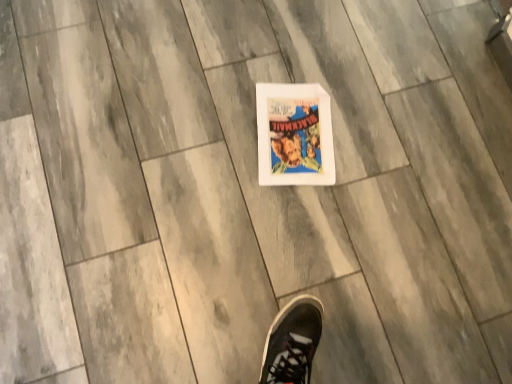
Image resolution: width=512 pixels, height=384 pixels. I want to click on vacant space in front of matte paper comic book at center, so click(x=285, y=218).